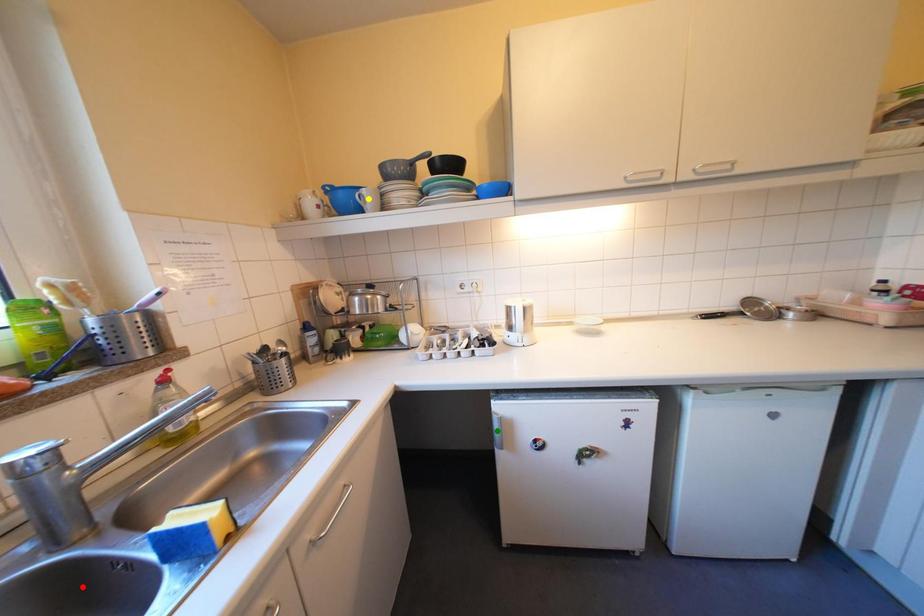
Order these from farthest to nearest:
yellow point
red point
green point

yellow point
green point
red point